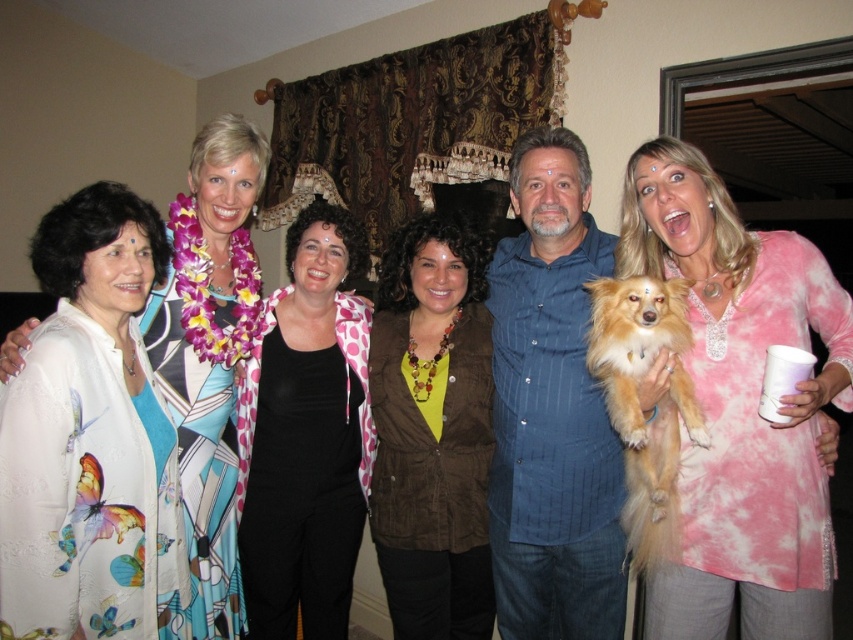
In the scene shown: Who is shorter, pink tie-dye shirt at center or brown corduroy vest at center?

With less height is brown corduroy vest at center.

Between pink tie-dye shirt at center and brown corduroy vest at center, which one appears on the left side from the viewer's perspective?

brown corduroy vest at center is more to the left.

Does point (718, 632) come behind point (457, 561)?

That is False.

You are a GUI agent. You are given a task and a screenshot of the screen. Output one action in this format:
    pyautogui.click(x=<x>, y=<y>)
    Task: Click on the pink tie-dye shirt at center
    The image size is (853, 640).
    Given the screenshot: What is the action you would take?
    pyautogui.click(x=740, y=404)

Does point (741, 481) come behind point (669, 394)?

No.

Between pink tie-dye shirt at center and golden fur dog at right, which one has less height?

golden fur dog at right

Is point (744, 572) positioned after point (679, 332)?

Yes, it is behind point (679, 332).

You are a GUI agent. You are given a task and a screenshot of the screen. Output one action in this format:
    pyautogui.click(x=<x>, y=<y>)
    Task: Click on the pink tie-dye shirt at center
    This screenshot has width=853, height=640.
    Given the screenshot: What is the action you would take?
    pyautogui.click(x=740, y=404)

Is printed silk blouse at left to the left of golden fur dog at right from the viewer's perspective?

Yes, printed silk blouse at left is to the left of golden fur dog at right.

Does point (204, 602) come in front of point (647, 544)?

No, (204, 602) is behind (647, 544).

Which is behind, point (222, 237) or point (624, 403)?

Point (222, 237)

The image size is (853, 640). What are the coordinates of `printed silk blouse at left` in the screenshot? It's located at (200, 461).